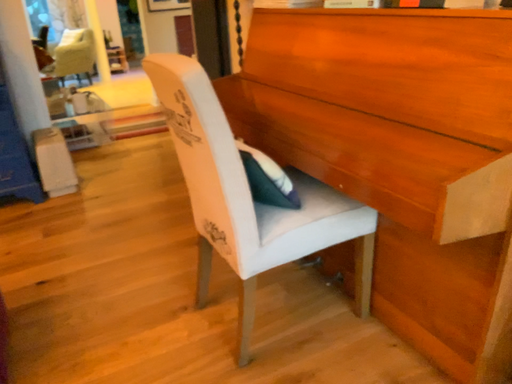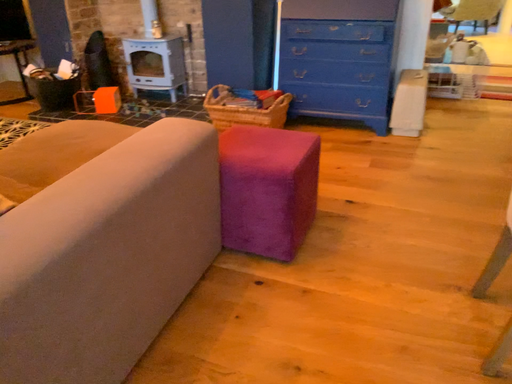
Question: Which way did the camera rotate in the video?

Choices:
 (A) rotated left
 (B) rotated right

Answer: (A)